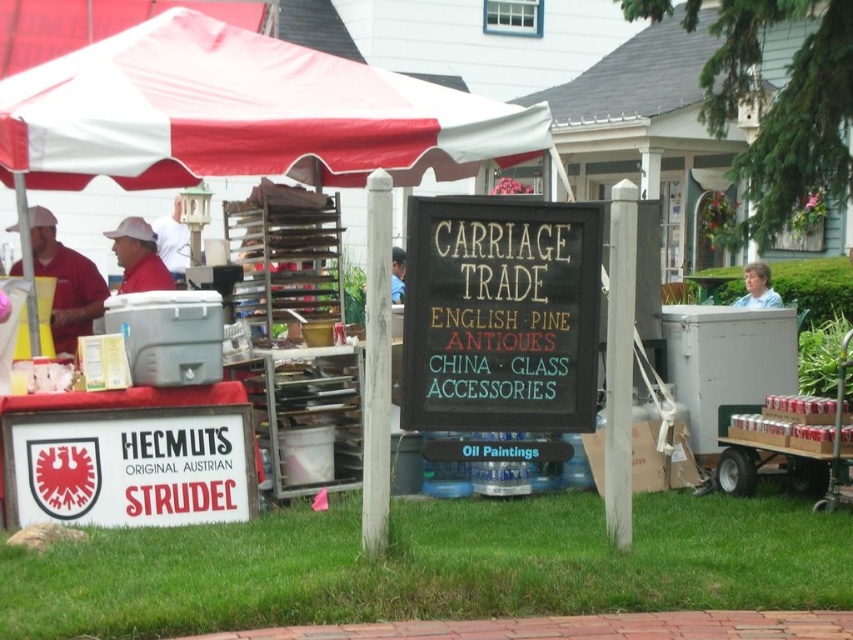
Question: Is light blue shirt at right smaller than blue fabric shirt at center?

Choices:
 (A) no
 (B) yes

Answer: (B)

Question: Which object appears farthest from the camera in this image?

Choices:
 (A) red/white fabric canopy at upper left
 (B) black chalkboard sign at center
 (C) blue fabric shirt at center

Answer: (A)

Question: Observing the image, what is the correct spatial positioning of light blue shirt at right in reference to blue fabric shirt at center?

Choices:
 (A) below
 (B) above

Answer: (A)

Question: Among these points, which one is farthest from the camera?

Choices:
 (A) (397, 268)
 (B) (764, 280)
 (C) (363, 115)

Answer: (A)

Question: Estimate the real-world distances between objects in this image. Which object is farther from the matte red shirt at left?

Choices:
 (A) blue fabric shirt at center
 (B) black chalkboard sign at center
 (C) light blue shirt at right

Answer: (C)

Question: Can you confirm if red/white fabric canopy at upper left is positioned to the right of light blue shirt at right?

Choices:
 (A) yes
 (B) no

Answer: (B)